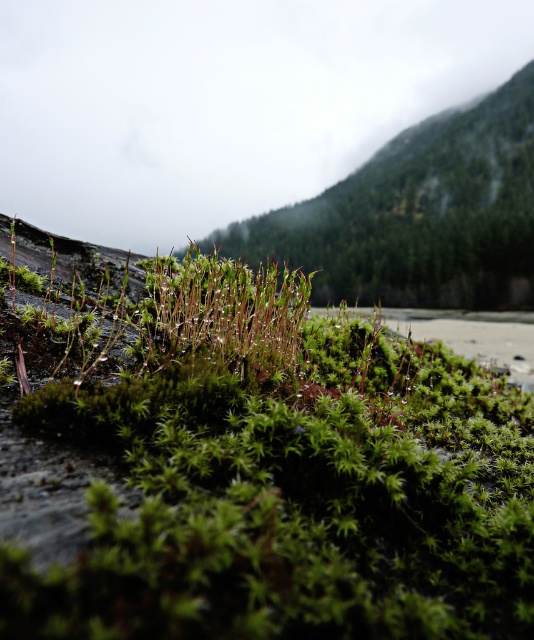
Question: Estimate the real-world distances between objects in this image. Which object is closer to the green fuzzy moss at center?

Choices:
 (A) green mossy hillside at upper center
 (B) green mossy plant at center

Answer: (B)

Question: Is green mossy hillside at upper center to the right of green mossy plant at center from the viewer's perspective?

Choices:
 (A) no
 (B) yes

Answer: (B)

Question: Observing the image, what is the correct spatial positioning of green fuzzy moss at center in reference to green mossy hillside at upper center?

Choices:
 (A) right
 (B) left

Answer: (B)

Question: Among these objects, which one is nearest to the camera?

Choices:
 (A) green mossy hillside at upper center
 (B) green fuzzy moss at center

Answer: (B)

Question: Which of the following is the farthest from the observer?

Choices:
 (A) green fuzzy moss at center
 (B) green mossy hillside at upper center
 (C) green mossy plant at center

Answer: (B)

Question: Is green mossy hillside at upper center further to camera compared to green mossy plant at center?

Choices:
 (A) yes
 (B) no

Answer: (A)